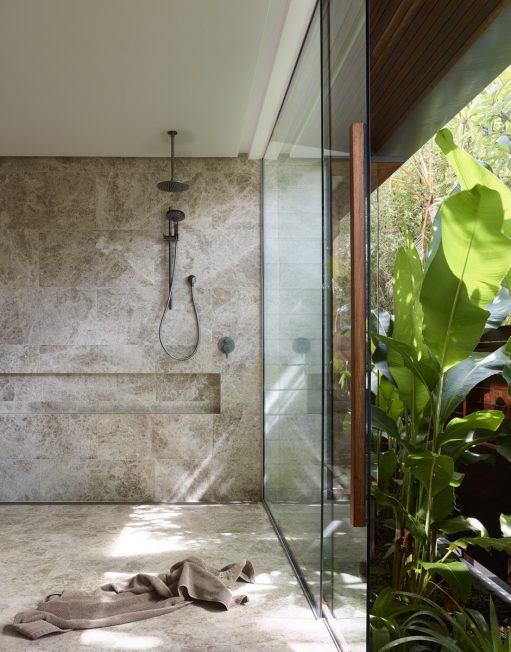
Where is `towel on ground`? towel on ground is located at coordinates (110, 612).